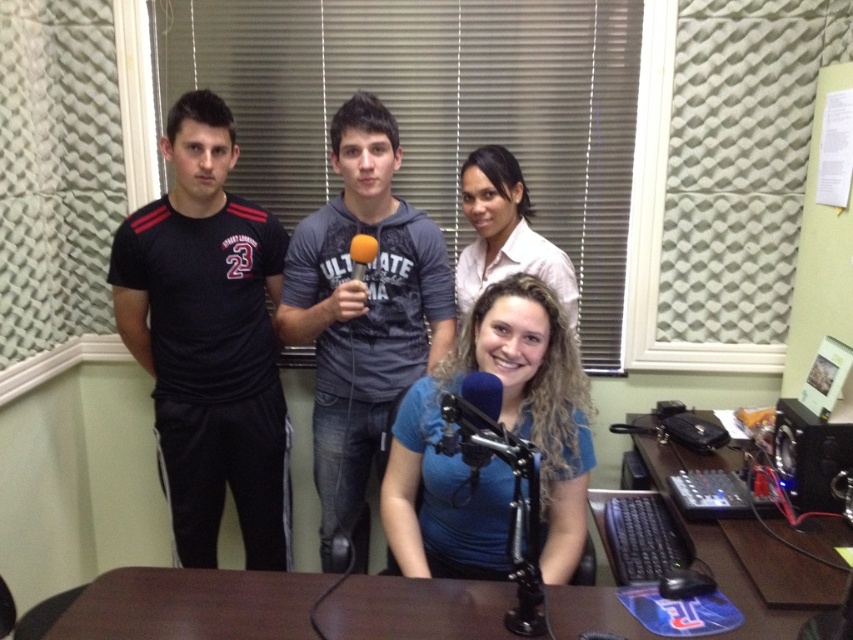
Question: Which point is closer to the camera taking this photo?

Choices:
 (A) (181, 280)
 (B) (546, 316)

Answer: (B)

Question: Estimate the real-world distances between objects in this image. Which object is closer to the matte pink shirt at upper center?

Choices:
 (A) blue matte shirt at center
 (B) black athletic wear at left

Answer: (A)

Question: Is black athletic wear at left smaller than orange fabric microphone at center?

Choices:
 (A) yes
 (B) no

Answer: (B)

Question: Can you confirm if black athletic wear at left is positioned below gray cotton shirt at center?

Choices:
 (A) yes
 (B) no

Answer: (A)

Question: Is black athletic wear at left bigger than blue matte shirt at center?

Choices:
 (A) no
 (B) yes

Answer: (B)

Question: Which point is closer to the camera?

Choices:
 (A) (463, 212)
 (B) (363, 236)
 (C) (450, 474)

Answer: (C)